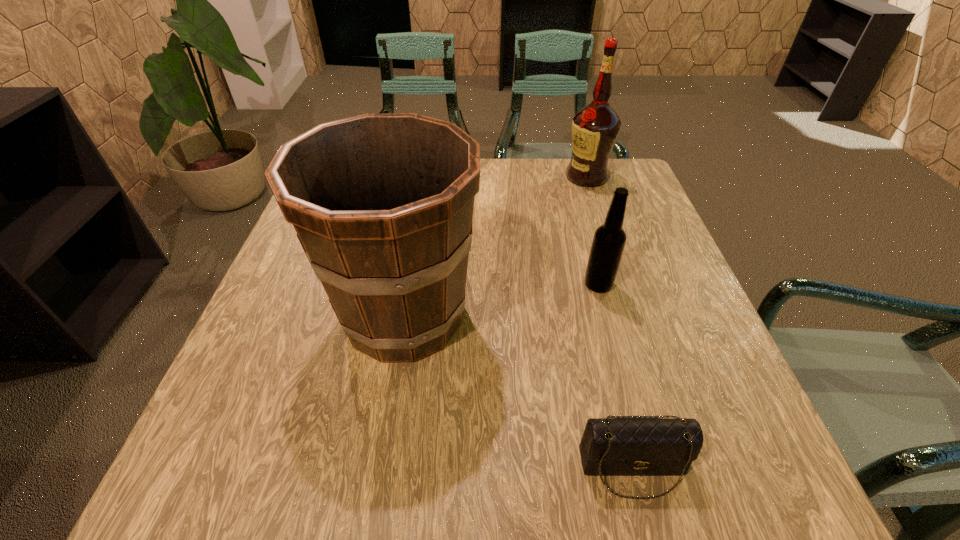
At what (x,y) coordinates should I click in order to perform the action: click on object present at the far edge. Please return your answer as a coordinate pair (x, y). This screenshot has height=540, width=960. Looking at the image, I should click on (595, 128).

This screenshot has height=540, width=960. What are the coordinates of `object present at the near edge` in the screenshot? It's located at (616, 445).

The image size is (960, 540). I want to click on object that is positioned at the left edge, so click(382, 203).

Find the location of a particular element. alcohol present at the right edge is located at coordinates coord(595,128).

The height and width of the screenshot is (540, 960). Find the location of `beer bottle positioned at the right edge`. beer bottle positioned at the right edge is located at coordinates (609, 240).

The width and height of the screenshot is (960, 540). Identify the location of clutch bag at the right edge. (616, 445).

You are a GUI agent. You are given a task and a screenshot of the screen. Output one action in this format:
    pyautogui.click(x=<x>, y=<y>)
    Task: Click on the object that is positioned at the far right corner
    Image resolution: width=960 pixels, height=540 pixels.
    Given the screenshot: What is the action you would take?
    click(x=595, y=128)

At what (x,y) coordinates should I click in order to perform the action: click on object present at the near right corner. Please return your answer as a coordinate pair (x, y). The image size is (960, 540). Looking at the image, I should click on (616, 445).

In the image, there is a desktop. Where is `vacant area at the far edge`? Image resolution: width=960 pixels, height=540 pixels. vacant area at the far edge is located at coordinates (571, 194).

Identify the location of vacant space at the near edge of the desktop. (346, 472).